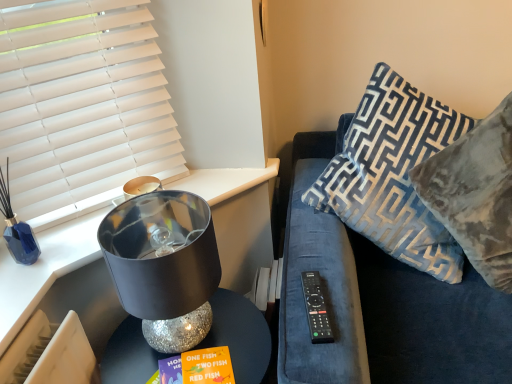
Measure the distance between point (95,282) and camera.

The depth of point (95,282) is 1.24 meters.

What do you see at coordinates (240, 335) in the screenshot?
I see `sparkly silver table at lower left` at bounding box center [240, 335].

The width and height of the screenshot is (512, 384). What do you see at coordinates (393, 174) in the screenshot?
I see `blue velvet pillow at right, acting as the second pillow starting from the right` at bounding box center [393, 174].

Where is `shiny metallic lampshade at left`? The height and width of the screenshot is (384, 512). shiny metallic lampshade at left is located at coordinates (164, 265).

What are the coordinates of `shiny metallic lamp at left` in the screenshot? It's located at (61, 283).

Between velvet blue couch at right and sparkly silver table at lower left, which one is positioned in front?

velvet blue couch at right is closer to the camera.

Considering the sizes of objects velvet blue couch at right and sparkly silver table at lower left in the image provided, who is shorter, velvet blue couch at right or sparkly silver table at lower left?

With less height is sparkly silver table at lower left.

How many degrees apart are the facing directions of velvet blue couch at right and sparkly silver table at lower left?

The angular difference between velvet blue couch at right and sparkly silver table at lower left is 3.02 degrees.

Who is smaller, velvet blue couch at right or sparkly silver table at lower left?

With smaller size is sparkly silver table at lower left.

Where is `table behind the velvet blue pillow at upper right, which appears as the 2th pillow when viewed from the left`? This screenshot has width=512, height=384. table behind the velvet blue pillow at upper right, which appears as the 2th pillow when viewed from the left is located at coordinates (240, 335).

Between velvet blue pillow at upper right, which ranks as the first pillow in right-to-left order, and sparkly silver table at lower left, which one has smaller width?

Thinner between the two is sparkly silver table at lower left.

From a real-world perspective, is velvet blue pillow at upper right, which ranks as the first pillow in right-to-left order, positioned above or below sparkly silver table at lower left?

Clearly, from a real-world perspective, velvet blue pillow at upper right, which ranks as the first pillow in right-to-left order, is above sparkly silver table at lower left.

Would you consider velvet blue pillow at upper right, which ranks as the first pillow in right-to-left order, to be distant from sparkly silver table at lower left?

No, there isn't a large distance between velvet blue pillow at upper right, which ranks as the first pillow in right-to-left order, and sparkly silver table at lower left.

Where is `the 2nd pillow above when counting from the black plastic remote at right (from the image's perspective)`? This screenshot has height=384, width=512. the 2nd pillow above when counting from the black plastic remote at right (from the image's perspective) is located at coordinates (393, 174).

What's the angular difference between blue velvet pillow at right, placed as the 1th pillow when sorted from left to right, and black plastic remote at right's facing directions?

There is a 6.86-degree angle between the facing directions of blue velvet pillow at right, placed as the 1th pillow when sorted from left to right, and black plastic remote at right.

Considering the sizes of blue velvet pillow at right, placed as the 1th pillow when sorted from left to right, and black plastic remote at right in the image, is blue velvet pillow at right, placed as the 1th pillow when sorted from left to right, taller or shorter than black plastic remote at right?

blue velvet pillow at right, placed as the 1th pillow when sorted from left to right, is taller than black plastic remote at right.

Can you confirm if blue velvet pillow at right, acting as the second pillow starting from the right, is smaller than black plastic remote at right?

Actually, blue velvet pillow at right, acting as the second pillow starting from the right, might be larger than black plastic remote at right.

Is black plastic remote at right placed right next to velvet blue pillow at upper right, which ranks as the first pillow in right-to-left order?

There is a gap between black plastic remote at right and velvet blue pillow at upper right, which ranks as the first pillow in right-to-left order.

In terms of width, does black plastic remote at right look wider or thinner when compared to velvet blue pillow at upper right, which ranks as the first pillow in right-to-left order?

Clearly, black plastic remote at right has less width compared to velvet blue pillow at upper right, which ranks as the first pillow in right-to-left order.

Considering the sizes of objects black plastic remote at right and velvet blue pillow at upper right, which appears as the 2th pillow when viewed from the left, in the image provided, who is smaller, black plastic remote at right or velvet blue pillow at upper right, which appears as the 2th pillow when viewed from the left,?

black plastic remote at right is smaller.

Measure the distance from black plastic remote at right to velvet blue pillow at upper right, which appears as the 2th pillow when viewed from the left.

They are 19.40 inches apart.

Who is more distant, velvet blue pillow at upper right, which ranks as the first pillow in right-to-left order, or blue velvet pillow at right, placed as the 1th pillow when sorted from left to right?

blue velvet pillow at right, placed as the 1th pillow when sorted from left to right, is more distant.

From a real-world perspective, between velvet blue pillow at upper right, which ranks as the first pillow in right-to-left order, and blue velvet pillow at right, placed as the 1th pillow when sorted from left to right, who is vertically higher?

From a 3D spatial view, blue velvet pillow at right, placed as the 1th pillow when sorted from left to right, is above.

Which point is more forward, [474,239] or [426,122]?

The point [474,239] is more forward.

The height and width of the screenshot is (384, 512). I want to click on furniture to the right of white matte window blind at upper left, so coord(61,283).

Is shiny metallic lamp at left aimed at white matte window blind at upper left?

No, shiny metallic lamp at left is not facing towards white matte window blind at upper left.

Looking at this image, between shiny metallic lamp at left and white matte window blind at upper left, which one has larger width?

shiny metallic lamp at left.

Does point (248, 369) appear closer or farther from the camera than point (378, 166)?

Point (248, 369) appears to be closer to the viewer than point (378, 166).

Is sparkly silver table at lower left at the right side of blue velvet pillow at right, placed as the 1th pillow when sorted from left to right?

No, sparkly silver table at lower left is not to the right of blue velvet pillow at right, placed as the 1th pillow when sorted from left to right.

In the scene shown: From a real-world perspective, which is physically below, sparkly silver table at lower left or blue velvet pillow at right, placed as the 1th pillow when sorted from left to right?

sparkly silver table at lower left, from a real-world perspective.

Locate an element on the screen. Image resolution: width=512 pixels, height=384 pixels. couch that appears on the right of sparkly silver table at lower left is located at coordinates (428, 321).

Locate an element on the screen. The height and width of the screenshot is (384, 512). the 1st pillow positioned above the sparkly silver table at lower left (from a real-world perspective) is located at coordinates (475, 194).

Based on their spatial positions, is shiny metallic lamp at left or velvet blue pillow at upper right, which appears as the 2th pillow when viewed from the left, closer to black plastic remote at right?

velvet blue pillow at upper right, which appears as the 2th pillow when viewed from the left, lies closer to black plastic remote at right than the other object.

Considering their positions, is shiny metallic lamp at left positioned further to shiny metallic lampshade at left than velvet blue pillow at upper right, which ranks as the first pillow in right-to-left order?

Among the two, velvet blue pillow at upper right, which ranks as the first pillow in right-to-left order, is located further to shiny metallic lampshade at left.

From the image, which object appears to be nearer to shiny metallic lamp at left, blue velvet pillow at right, acting as the second pillow starting from the right, or shiny metallic lampshade at left?

shiny metallic lampshade at left is positioned closer to the anchor shiny metallic lamp at left.

Estimate the real-world distances between objects in this image. Which object is closer to sparkly silver table at lower left, black plastic remote at right or shiny metallic lamp at left?

Among the two, shiny metallic lamp at left is located nearer to sparkly silver table at lower left.

Looking at the image, which one is located further to velvet blue pillow at upper right, which ranks as the first pillow in right-to-left order, sparkly silver table at lower left or black plastic remote at right?

Among the two, sparkly silver table at lower left is located further to velvet blue pillow at upper right, which ranks as the first pillow in right-to-left order.

Looking at the image, which one is located closer to white matte window blind at upper left, velvet blue pillow at upper right, which ranks as the first pillow in right-to-left order, or shiny metallic lampshade at left?

Based on the image, shiny metallic lampshade at left appears to be nearer to white matte window blind at upper left.

Consider the image. Considering their positions, is velvet blue pillow at upper right, which ranks as the first pillow in right-to-left order, positioned closer to blue velvet pillow at right, placed as the 1th pillow when sorted from left to right, than shiny metallic lampshade at left?

Based on the image, velvet blue pillow at upper right, which ranks as the first pillow in right-to-left order, appears to be nearer to blue velvet pillow at right, placed as the 1th pillow when sorted from left to right.

Looking at this image, looking at the image, which one is located further to shiny metallic lampshade at left, sparkly silver table at lower left or blue velvet pillow at right, acting as the second pillow starting from the right?

blue velvet pillow at right, acting as the second pillow starting from the right.

This screenshot has height=384, width=512. Find the location of `pillow between shiny metallic lamp at left and velvet blue pillow at upper right, which ranks as the first pillow in right-to-left order`. pillow between shiny metallic lamp at left and velvet blue pillow at upper right, which ranks as the first pillow in right-to-left order is located at coordinates (393, 174).

You are a GUI agent. You are given a task and a screenshot of the screen. Output one action in this format:
    pyautogui.click(x=<x>, y=<y>)
    Task: Click on the pillow between shiny metallic lampshade at left and velvet blue pillow at upper right, which appears as the 2th pillow when viewed from the left
    The width and height of the screenshot is (512, 384).
    Given the screenshot: What is the action you would take?
    pyautogui.click(x=393, y=174)

Identify the location of pillow between black plastic remote at right and velvet blue pillow at upper right, which appears as the 2th pillow when viewed from the left, from left to right. (393, 174).

Locate an element on the screen. The width and height of the screenshot is (512, 384). pillow between white matte window blind at upper left and velvet blue couch at right in the horizontal direction is located at coordinates (393, 174).